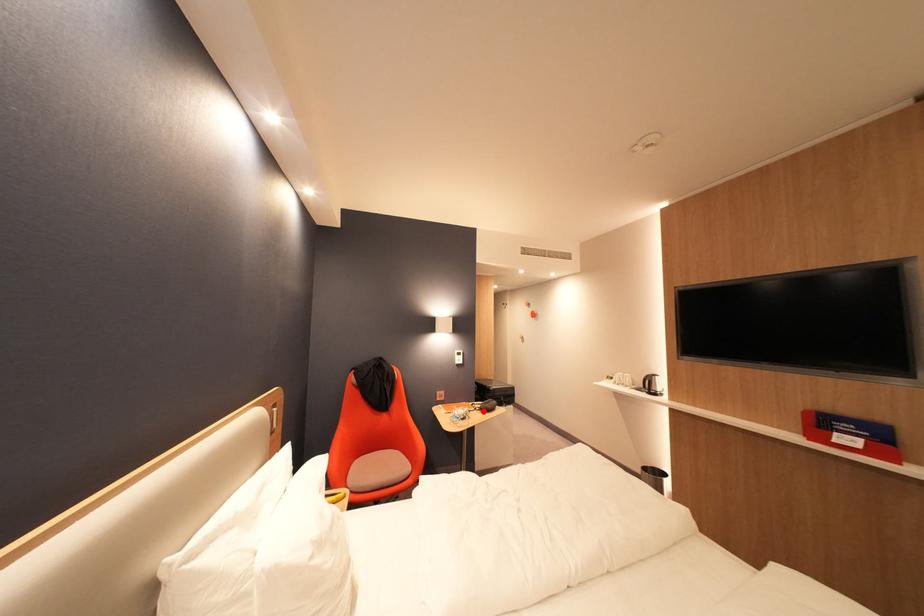
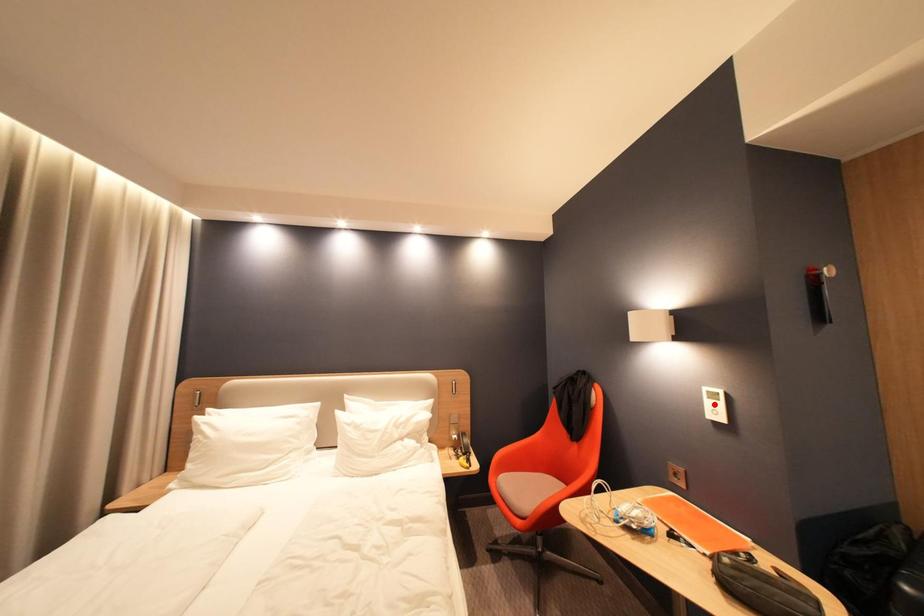
I am providing you with two images of the same scene from different viewpoints. A red point is marked on the first image and another point is marked on the second image. Do the highlighted points in image1 and image2 indicate the same real-world spot?

No